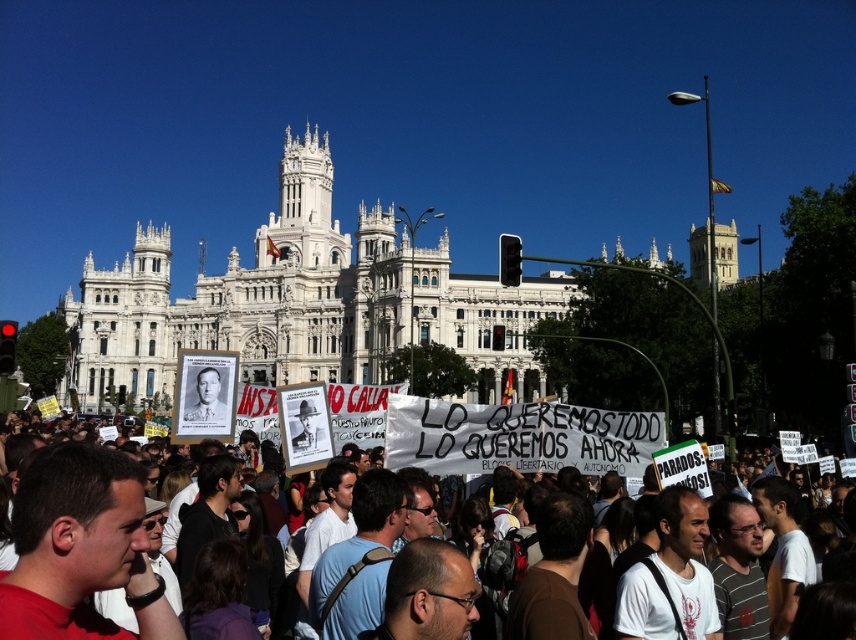
You are a photographer trying to capture the white stone building at center and the white paper signs at center in a single frame. Based on their sizes, which object will appear larger in your photo?

The white stone building at center will appear larger in the photo because its width is larger than that of the white paper signs at center.

You are a photographer standing in front of the white stone building at center and the white paper signs at center. You want to take a photo that includes both the building and the signs. Which object should be placed closer to the camera to ensure both are in focus?

The white stone building at center is positioned over white paper signs at center, so to ensure both are in focus, the white paper signs at center should be closer to the camera.

You are a photographer at the demonstration. You want to take a photo of the white stone building at center without the white paper signs at center appearing in the shot. Is this possible given their positions?

The white paper signs at center are behind the white stone building at center, so taking a photo from the front would hide the signs behind the building, making it possible to capture the building without the signs.